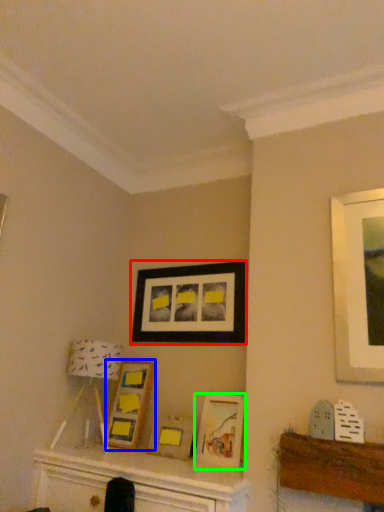
Question: Which is farther away from picture frame (highlighted by a red box)? picture frame (highlighted by a blue box) or picture frame (highlighted by a green box)?

Choices:
 (A) picture frame
 (B) picture frame

Answer: (B)